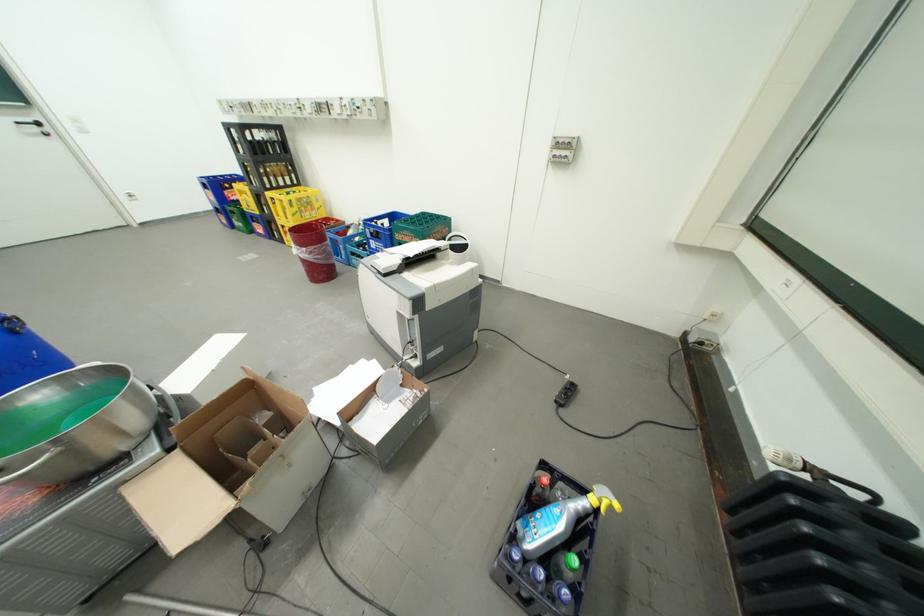
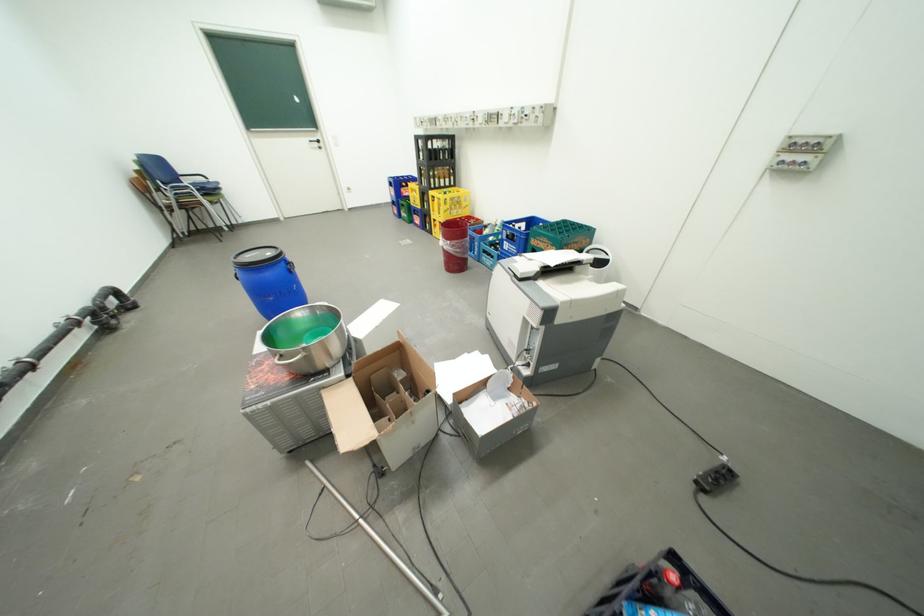
Question: In a continuous first-person perspective shot, in which direction is the camera moving?

Choices:
 (A) Left
 (B) Right
 (C) Forward
 (D) Backward

Answer: (A)